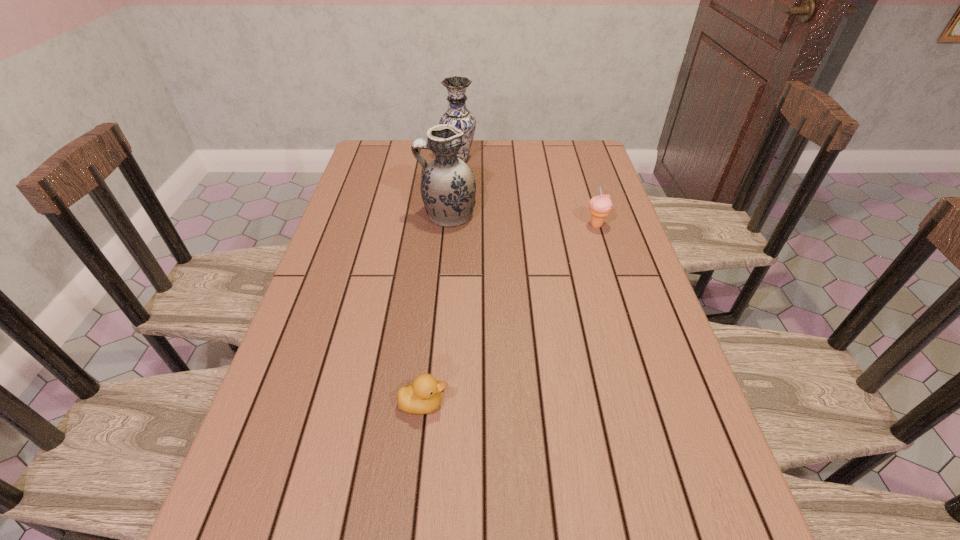
At what (x,y) coordinates should I click in order to perform the action: click on the nearer vase. Please return your answer as a coordinate pair (x, y). This screenshot has height=540, width=960. Looking at the image, I should click on (448, 187).

Where is `the farthest object`? The image size is (960, 540). the farthest object is located at coordinates (457, 114).

You are a GUI agent. You are given a task and a screenshot of the screen. Output one action in this format:
    pyautogui.click(x=<x>, y=<y>)
    Task: Click on the rightmost object
    The image size is (960, 540).
    Given the screenshot: What is the action you would take?
    pyautogui.click(x=600, y=206)

The image size is (960, 540). Find the location of `the third tallest object`. the third tallest object is located at coordinates (600, 206).

Locate an element on the screen. This screenshot has height=540, width=960. duckling is located at coordinates (423, 396).

This screenshot has width=960, height=540. Identify the location of the nearest object. (423, 396).

Identify the location of vacant space located with the handle on the side of the nearer vase. Image resolution: width=960 pixels, height=540 pixels. (349, 215).

Locate an element on the screen. vacant space located with the handle on the side of the nearer vase is located at coordinates (372, 215).

Locate an element on the screen. vacant space located with the handle on the side of the nearer vase is located at coordinates (349, 215).

Locate an element on the screen. Image resolution: width=960 pixels, height=540 pixels. vacant space located 0.270m on the right of the farther vase is located at coordinates coord(552,159).